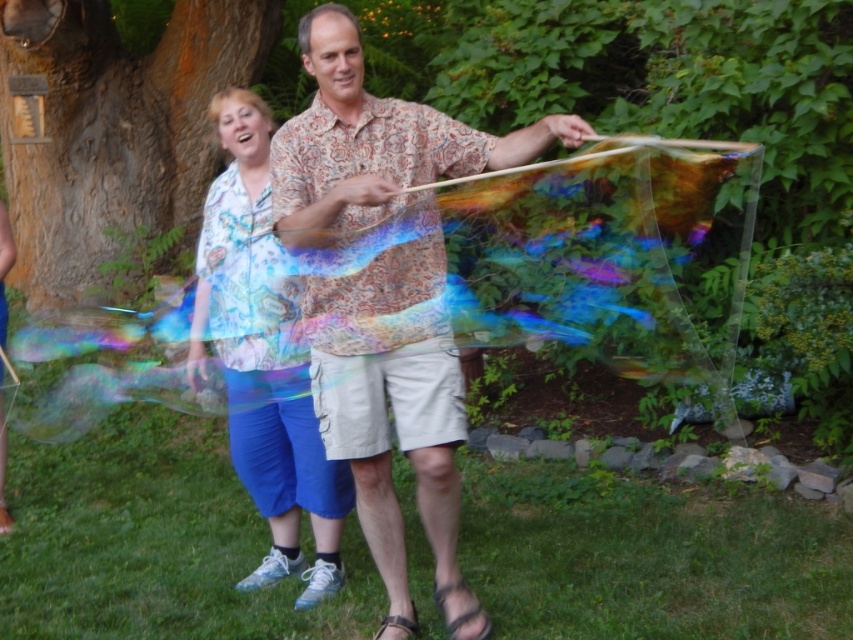
You are standing in the garden and want to find the patterned fabric shirt at center. According to the image, where would you look in terms of coordinates?

The patterned fabric shirt at center is located at coordinates approximately 0.463 on the x axis and 0.453 on the y axis.

You are standing in the garden and want to place a small flag exactly halfway between point (379,570) and point (265,509). Will the flag be closer to the front or the back of the garden compared to the two points?

The flag placed halfway between point (379,570) and point (265,509) will be closer to the back of the garden compared to the two points because point (379,570) is closer to the viewer than point (265,509), so the midpoint would be closer to the farther point.

You are trying to determine which clothing item is taller between the patterned fabric shirt at center and the matte floral blouse at center. Based on the scene description, which one has a greater height?

The patterned fabric shirt at center has a greater height compared to the matte floral blouse at center.